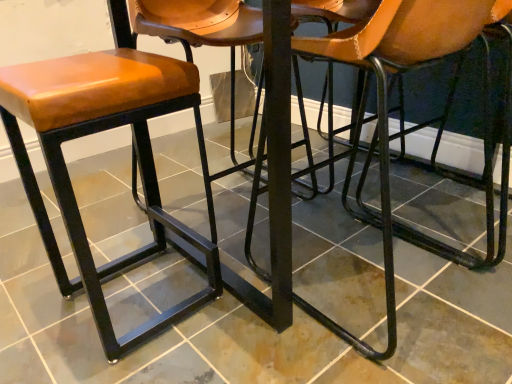
Question: From a real-world perspective, does brown leather chair at center sit lower than matte brown leather stool at left?

Choices:
 (A) no
 (B) yes

Answer: (A)

Question: Considering the relative sizes of brown leather chair at center and matte brown leather stool at left in the image provided, is brown leather chair at center shorter than matte brown leather stool at left?

Choices:
 (A) yes
 (B) no

Answer: (B)

Question: Would you say brown leather chair at center is outside matte brown leather stool at left?

Choices:
 (A) no
 (B) yes

Answer: (B)

Question: From the image's perspective, is brown leather chair at center on matte brown leather stool at left?

Choices:
 (A) no
 (B) yes

Answer: (B)

Question: Is brown leather chair at center turned away from matte brown leather stool at left?

Choices:
 (A) yes
 (B) no

Answer: (B)

Question: From their relative heights in the image, would you say matte brown leather stool at left is taller or shorter than matte black stool at center?

Choices:
 (A) short
 (B) tall

Answer: (B)

Question: Considering their positions, is matte brown leather stool at left located in front of or behind matte black stool at center?

Choices:
 (A) behind
 (B) front

Answer: (A)

Question: Do you think matte brown leather stool at left is within matte black stool at center, or outside of it?

Choices:
 (A) outside
 (B) inside

Answer: (A)

Question: In terms of size, does matte brown leather stool at left appear bigger or smaller than matte black stool at center?

Choices:
 (A) small
 (B) big

Answer: (A)

Question: From the image's perspective, is matte brown leather stool at left above or below brown leather chair at center?

Choices:
 (A) above
 (B) below

Answer: (B)

Question: Considering the positions of matte brown leather stool at left and brown leather chair at center in the image, is matte brown leather stool at left wider or thinner than brown leather chair at center?

Choices:
 (A) wide
 (B) thin

Answer: (B)

Question: Visually, is matte brown leather stool at left positioned to the left or to the right of brown leather chair at center?

Choices:
 (A) right
 (B) left

Answer: (B)

Question: Is matte brown leather stool at left bigger or smaller than brown leather chair at center?

Choices:
 (A) big
 (B) small

Answer: (B)

Question: Visually, is matte black stool at center positioned to the left or to the right of brown leather chair at center?

Choices:
 (A) right
 (B) left

Answer: (B)

Question: Is matte black stool at center inside or outside of brown leather chair at center?

Choices:
 (A) outside
 (B) inside

Answer: (A)